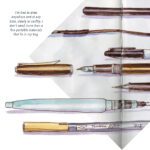
Where is `image of pens`? Image resolution: width=150 pixels, height=150 pixels. image of pens is located at coordinates 71,109, 70,127, 108,70, 92,31.